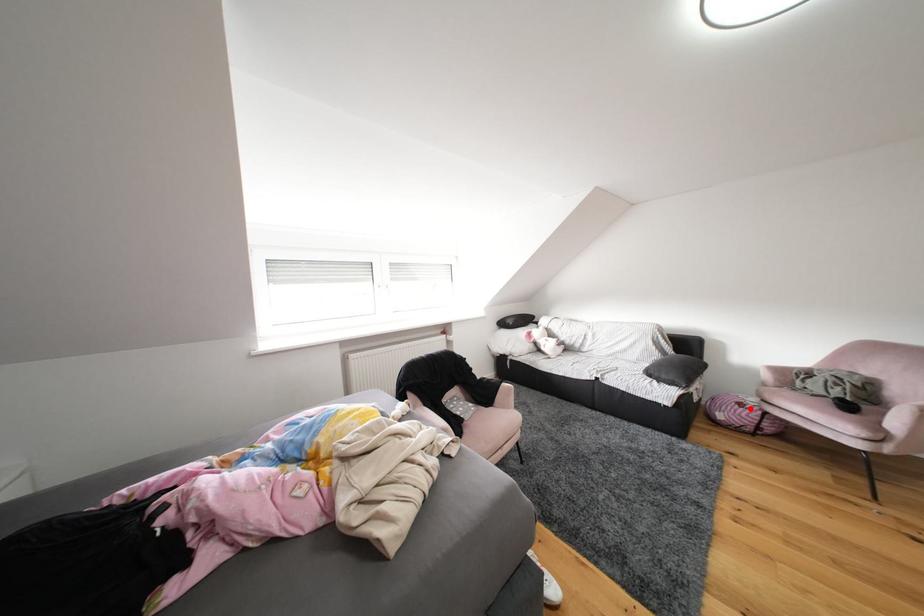
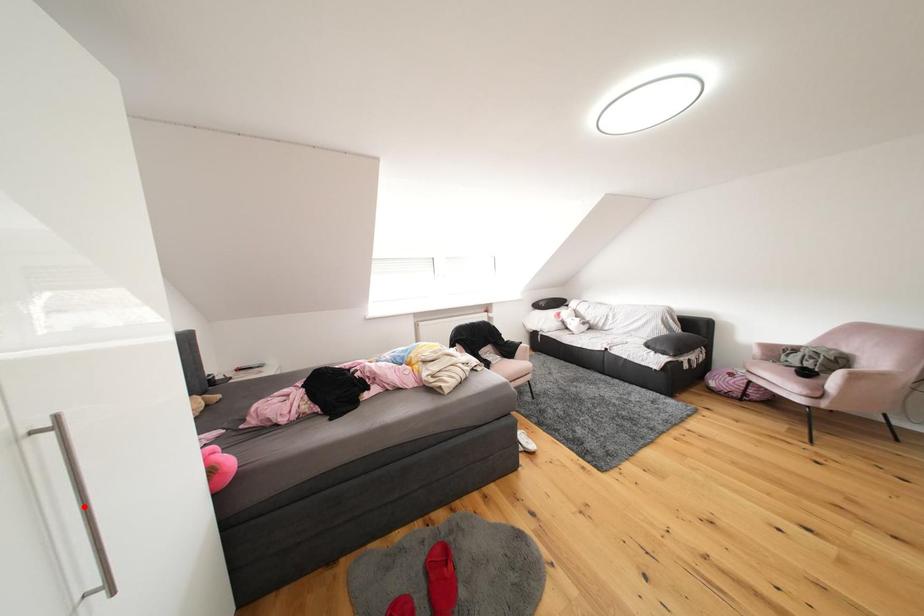
I am providing you with two images of the same scene from different viewpoints. A red point is marked on the first image and another point is marked on the second image. Do the highlighted points in image1 and image2 indicate the same real-world spot?

No